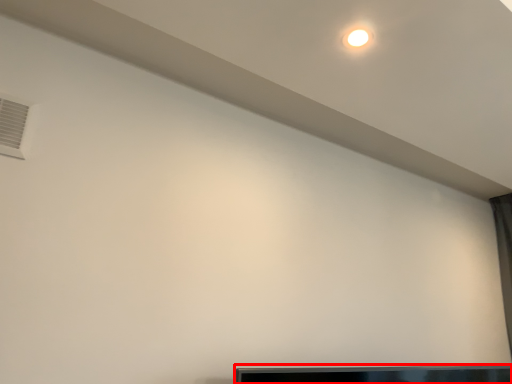
Question: Considering the relative positions of furniture (annotated by the red box) and air conditioning in the image provided, where is furniture (annotated by the red box) located with respect to the staircase?

Choices:
 (A) right
 (B) left

Answer: (A)